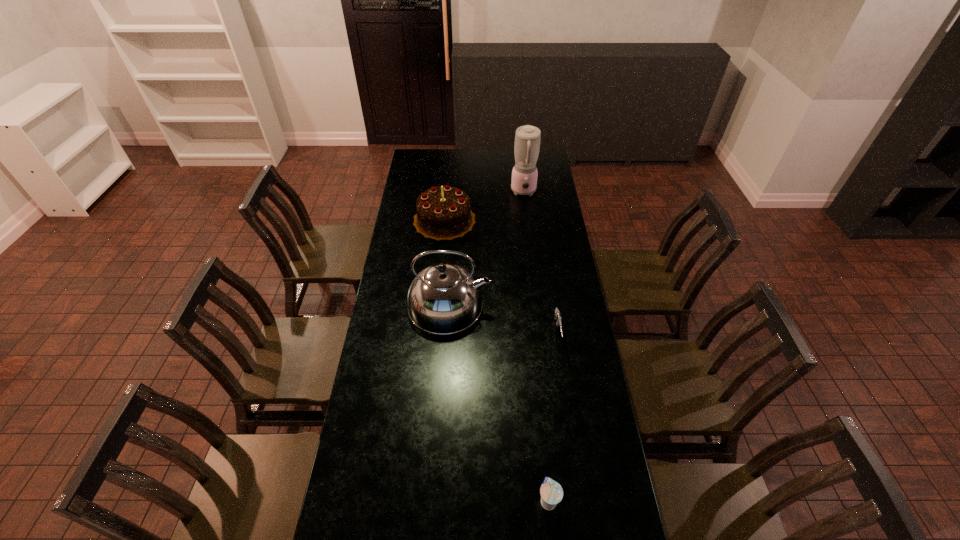
At what (x,y) coordinates should I click in order to perform the action: click on vacant area that satisfies the following two spatial constraints: 1. from the spout of the nearest object; 2. on the left side of the second tallest object. Please return your answer as a coordinate pair (x, y). Looking at the image, I should click on (437, 500).

The height and width of the screenshot is (540, 960). What are the coordinates of `free space that satisfies the following two spatial constraints: 1. from the spout of the yogurt; 2. on the right side of the kettle` in the screenshot? It's located at (437, 500).